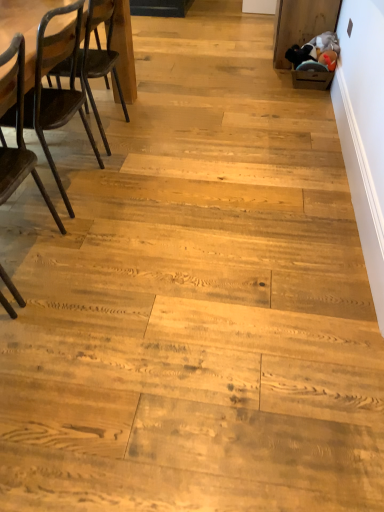
Question: Can you confirm if dark brown wood chair at left, marked as the first chair in a back-to-front arrangement, is smaller than dark brown wood chair at left, the 2th chair viewed from the back?

Choices:
 (A) no
 (B) yes

Answer: (A)

Question: From a real-world perspective, does dark brown wood chair at left, marked as the first chair in a back-to-front arrangement, sit lower than dark brown wood chair at left, the 2th chair viewed from the back?

Choices:
 (A) no
 (B) yes

Answer: (B)

Question: Is dark brown wood chair at left, marked as the first chair in a back-to-front arrangement, at the left side of dark brown wood chair at left, the 2th chair viewed from the back?

Choices:
 (A) yes
 (B) no

Answer: (B)

Question: Is dark brown wood chair at left, positioned as the 2th chair in front-to-back order, turned away from dark brown wood chair at left, the 2th chair viewed from the back?

Choices:
 (A) no
 (B) yes

Answer: (A)

Question: Could dark brown wood chair at left, the 1th chair viewed from the front, be considered to be inside dark brown wood chair at left, marked as the first chair in a back-to-front arrangement?

Choices:
 (A) no
 (B) yes

Answer: (A)

Question: Considering their positions, is dark brown wood table at left located in front of or behind dark brown wood chair at left, the 2th chair viewed from the back?

Choices:
 (A) behind
 (B) front

Answer: (A)

Question: Does point (29, 8) appear closer or farther from the camera than point (31, 172)?

Choices:
 (A) farther
 (B) closer

Answer: (A)

Question: Considering the positions of dark brown wood table at left and dark brown wood chair at left, the 2th chair viewed from the back, in the image, is dark brown wood table at left bigger or smaller than dark brown wood chair at left, the 2th chair viewed from the back,?

Choices:
 (A) big
 (B) small

Answer: (A)

Question: Considering the positions of dark brown wood table at left and dark brown wood chair at left, the 2th chair viewed from the back, in the image, is dark brown wood table at left taller or shorter than dark brown wood chair at left, the 2th chair viewed from the back,?

Choices:
 (A) tall
 (B) short

Answer: (B)

Question: In terms of width, does dark brown wood chair at left, marked as the first chair in a back-to-front arrangement, look wider or thinner when compared to dark brown wood table at left?

Choices:
 (A) thin
 (B) wide

Answer: (B)

Question: Based on their sizes in the image, would you say dark brown wood chair at left, positioned as the 2th chair in front-to-back order, is bigger or smaller than dark brown wood table at left?

Choices:
 (A) big
 (B) small

Answer: (A)

Question: From their relative heights in the image, would you say dark brown wood chair at left, marked as the first chair in a back-to-front arrangement, is taller or shorter than dark brown wood table at left?

Choices:
 (A) short
 (B) tall

Answer: (B)

Question: Which is correct: dark brown wood chair at left, positioned as the 2th chair in front-to-back order, is inside dark brown wood table at left, or outside of it?

Choices:
 (A) inside
 (B) outside

Answer: (B)

Question: From a real-world perspective, is dark brown wood chair at left, the 1th chair viewed from the front, physically located above or below dark brown wood chair at left, marked as the first chair in a back-to-front arrangement?

Choices:
 (A) above
 (B) below

Answer: (A)

Question: Is dark brown wood chair at left, the 1th chair viewed from the front, in front of or behind dark brown wood chair at left, positioned as the 2th chair in front-to-back order, in the image?

Choices:
 (A) front
 (B) behind

Answer: (A)